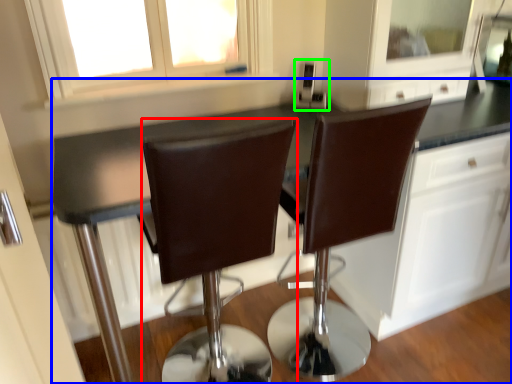
Question: Which object is positioned closest to chair (highlighted by a red box)? Select from countertop (highlighted by a blue box) and appliance (highlighted by a green box).

Choices:
 (A) countertop
 (B) appliance

Answer: (A)